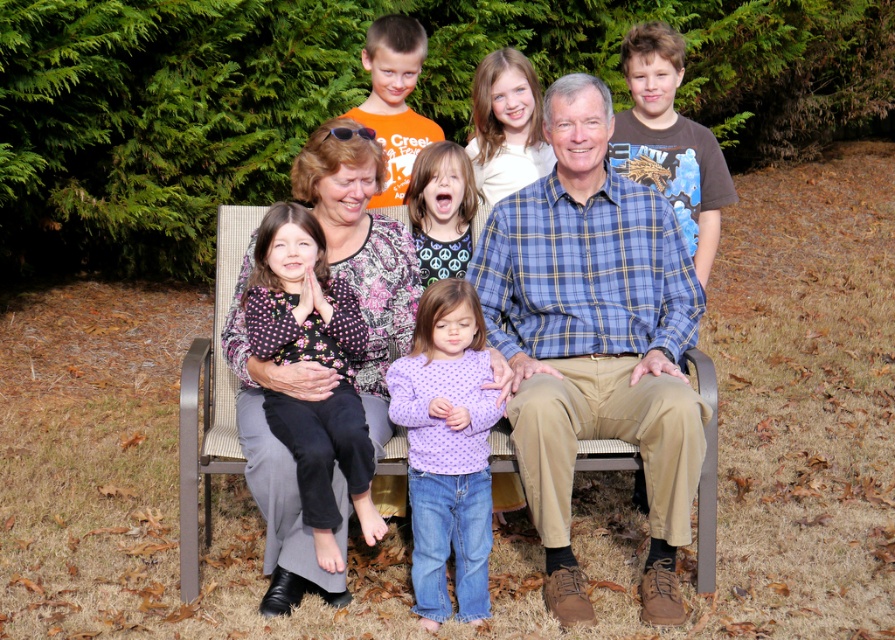
Does point (587, 182) lie in front of point (293, 353)?

No.

Between matte plaid shirt at center and floral-patterned shirt at center, which one has less height?

Standing shorter between the two is floral-patterned shirt at center.

Between point (687, 176) and point (293, 362), which one is positioned in front?

Point (293, 362) is more forward.

The width and height of the screenshot is (895, 640). I want to click on matte plaid shirt at center, so pos(601,326).

Does blue plaid shirt at center have a lesser width compared to purple dotted shirt at center?

In fact, blue plaid shirt at center might be wider than purple dotted shirt at center.

Does blue plaid shirt at center come behind purple dotted shirt at center?

No, it is in front of purple dotted shirt at center.

Measure the distance between point (x=561, y=611) and camera.

Point (x=561, y=611) and camera are 14.12 feet apart.

At what (x,y) coordinates should I click in order to perform the action: click on blue plaid shirt at center. Please return your answer as a coordinate pair (x, y). Looking at the image, I should click on (594, 340).

Is floral-patterned shirt at center taller than purple polka dot sweater at lower center?

Yes.

You are a GUI agent. You are given a task and a screenshot of the screen. Output one action in this format:
    pyautogui.click(x=<x>, y=<y>)
    Task: Click on the floral-patterned shirt at center
    Image resolution: width=895 pixels, height=640 pixels.
    Given the screenshot: What is the action you would take?
    pyautogui.click(x=314, y=362)

The height and width of the screenshot is (640, 895). What are the coordinates of `floral-patterned shirt at center` in the screenshot? It's located at (314, 362).